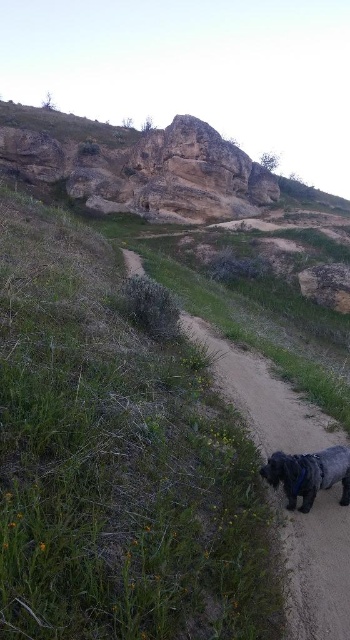
Which is more to the right, dirt path at center or shiny black dog at lower right?

From the viewer's perspective, shiny black dog at lower right appears more on the right side.

Is point (249, 406) farther from viewer compared to point (313, 456)?

Yes, point (249, 406) is behind point (313, 456).

In order to click on dirt path at center in this screenshot , I will do `click(317, 566)`.

What do you see at coordinates (144, 164) in the screenshot? This screenshot has height=640, width=350. I see `rugged stone cliff at upper center` at bounding box center [144, 164].

Does rugged stone cliff at upper center have a lesser width compared to shiny black dog at lower right?

No, rugged stone cliff at upper center is not thinner than shiny black dog at lower right.

Who is more distant from viewer, (x=267, y=186) or (x=268, y=474)?

Point (x=267, y=186)

In order to click on rugged stone cliff at upper center in this screenshot , I will do `click(144, 164)`.

Between rugged stone cliff at upper center and dirt path at center, which one is positioned lower?

dirt path at center is below.

Is rugged stone cliff at upper center positioned before dirt path at center?

That is False.

Describe the element at coordinates (144, 164) in the screenshot. I see `rugged stone cliff at upper center` at that location.

Where is `rugged stone cliff at upper center`? This screenshot has height=640, width=350. rugged stone cliff at upper center is located at coordinates (144, 164).